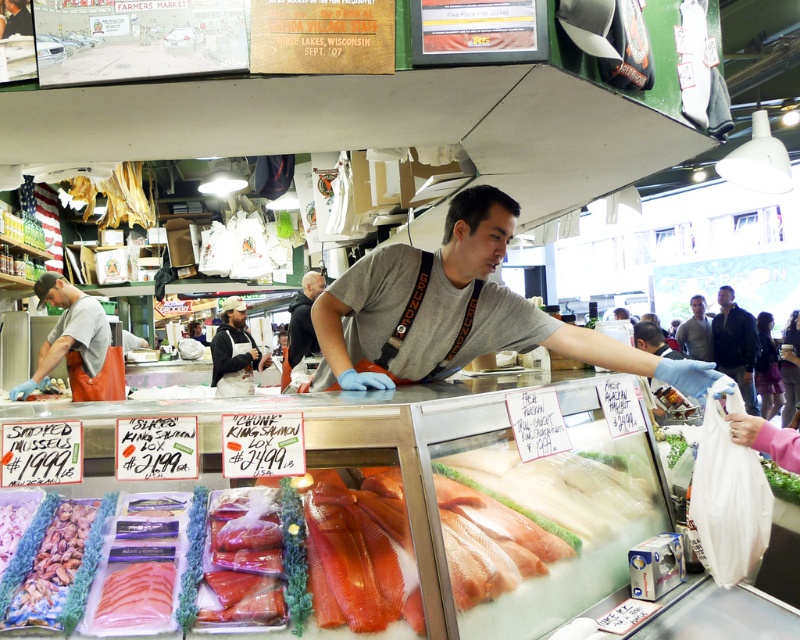
Question: Can you confirm if pinkish translucent salmon at center is positioned below orange apron at left?

Choices:
 (A) yes
 (B) no

Answer: (A)

Question: Can you confirm if shiny brown mussels at lower left is positioned below dark brown leather jacket at upper right?

Choices:
 (A) yes
 (B) no

Answer: (A)

Question: Considering the real-world distances, which object is farthest from the light brown leather jacket at upper right?

Choices:
 (A) gray cotton t-shirt at center
 (B) dark gray hoodie at center
 (C) smooth plastic bag at lower right

Answer: (A)

Question: Which point appears farthest from the camera in this image?

Choices:
 (A) (776, 381)
 (B) (786, 368)

Answer: (B)

Question: Which object is farther from the camera taking this photo?

Choices:
 (A) gray cotton t-shirt at center
 (B) dark blue fabric at lower right
 (C) light brown leather jacket at upper right
 (D) dark brown leather jacket at upper right

Answer: (C)

Question: Can you confirm if gray cotton t-shirt at center is positioned below pinkish translucent salmon at center?

Choices:
 (A) yes
 (B) no

Answer: (B)